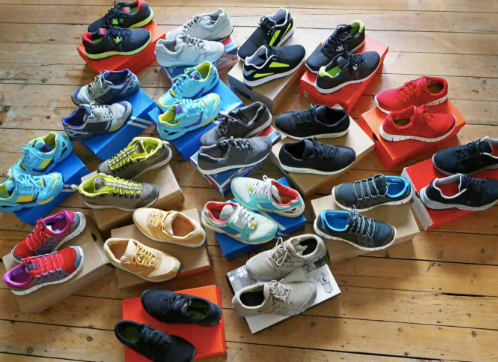
In order to click on pairs of shoes on an all red shoe box in this screenshot , I will do `click(186, 319)`, `click(445, 173)`, `click(398, 113)`, `click(335, 67)`, `click(126, 31)`.